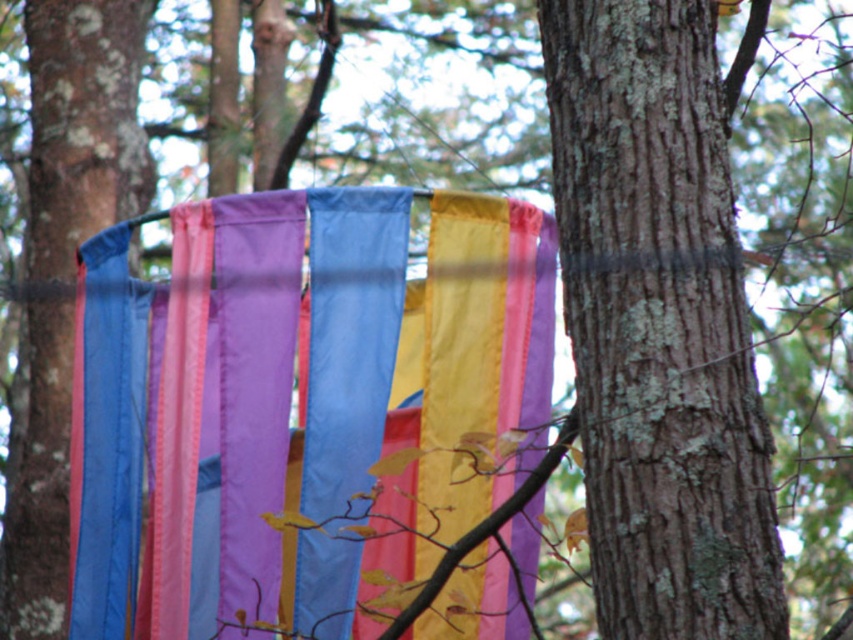
Can you confirm if smooth bark tree trunk at center is taller than smooth bark tree trunk at left?

Incorrect, smooth bark tree trunk at center's height is not larger of smooth bark tree trunk at left's.

Does point (704, 141) come behind point (51, 20)?

No, it is not.

Between point (712, 465) and point (80, 88), which one is positioned in front?

Point (712, 465) is more forward.

Identify the location of smooth bark tree trunk at center. (660, 321).

Does point (521, 262) lie behind point (97, 10)?

That is False.

What do you see at coordinates (289, 401) in the screenshot? I see `silky fabric strips at center` at bounding box center [289, 401].

Find the location of `silky fabric strips at center`. silky fabric strips at center is located at coordinates (289, 401).

You are a GUI agent. You are given a task and a screenshot of the screen. Output one action in this format:
    pyautogui.click(x=<x>, y=<y>)
    Task: Click on the silky fabric strips at center
    
    Given the screenshot: What is the action you would take?
    pyautogui.click(x=289, y=401)

Can you confirm if silky fabric strips at center is wider than smooth bark tree trunk at center?

Correct, the width of silky fabric strips at center exceeds that of smooth bark tree trunk at center.

Which is behind, point (189, 547) or point (668, 10)?

The point (189, 547) is more distant.

I want to click on silky fabric strips at center, so pos(289,401).